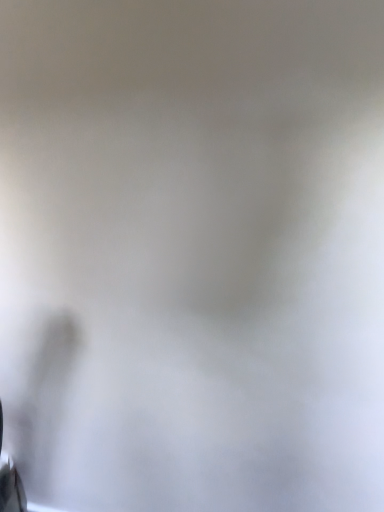
The width and height of the screenshot is (384, 512). Identify the location of metallic silver knife at lower left. (11, 488).

The height and width of the screenshot is (512, 384). What do you see at coordinates (11, 488) in the screenshot? I see `metallic silver knife at lower left` at bounding box center [11, 488].

Find the location of a particular element. This screenshot has width=384, height=512. metallic silver knife at lower left is located at coordinates (11, 488).